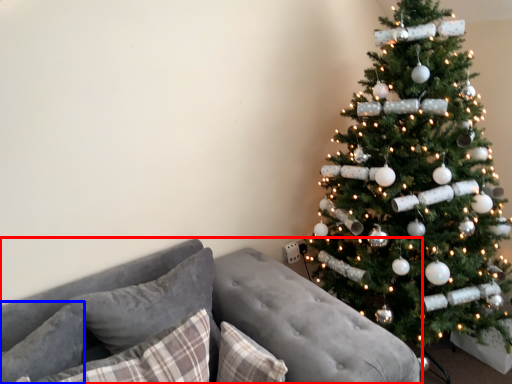
Question: Which object appears farthest to the camera in this image, studio couch (highlighted by a red box) or pillow (highlighted by a blue box)?

Choices:
 (A) studio couch
 (B) pillow

Answer: (B)